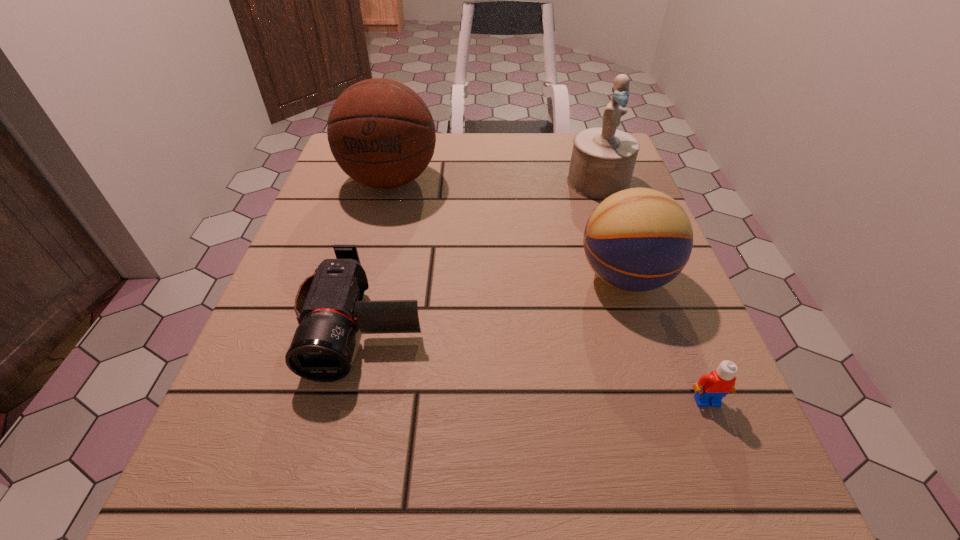
At what (x,y) coordinates should I click in order to perform the action: click on empty location between the camcorder and the Lego. Please return your answer as a coordinate pair (x, y). This screenshot has width=960, height=540. Looking at the image, I should click on (536, 362).

I want to click on blank region between the farther basketball and the Lego, so click(548, 291).

Find the location of a particular element. vacant area between the figurine and the nearest object is located at coordinates (652, 292).

At what (x,y) coordinates should I click in order to perform the action: click on free point between the shorter basketball and the camcorder. Please return your answer as a coordinate pair (x, y). Looking at the image, I should click on (494, 300).

The width and height of the screenshot is (960, 540). I want to click on vacant space that is in between the nearest object and the figurine, so click(652, 292).

The width and height of the screenshot is (960, 540). What are the coordinates of `free space between the camcorder and the shorter basketball` in the screenshot? It's located at (494, 300).

Where is `empty space that is in between the nearest object and the figurine`? empty space that is in between the nearest object and the figurine is located at coordinates (652, 292).

Point out which object is positioned as the second nearest to the figurine. Please provide its 2D coordinates. Your answer should be formatted as a tuple, i.e. [(x, y)], where the tuple contains the x and y coordinates of a point satisfying the conditions above.

[(381, 133)]

The image size is (960, 540). I want to click on object that can be found as the fourth closest to the taller basketball, so click(711, 388).

Where is `free spot that satisfies the following two spatial constraints: 1. at the beak of the figurine; 2. on the patterned surface of the right basketball`? Image resolution: width=960 pixels, height=540 pixels. free spot that satisfies the following two spatial constraints: 1. at the beak of the figurine; 2. on the patterned surface of the right basketball is located at coordinates (630, 277).